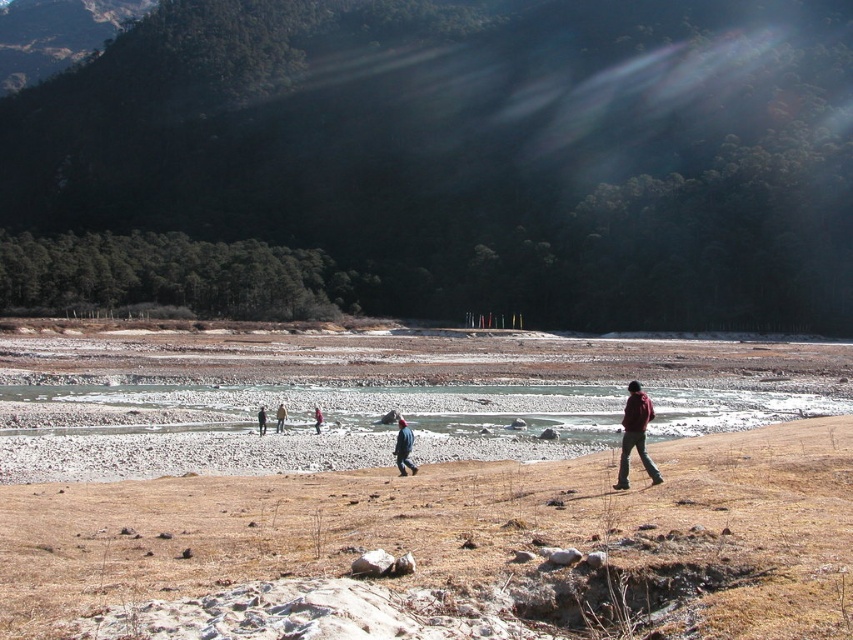
You are standing at the edge of the river and notice the brown dry grass at lower center and the dark blue jacket at center. Which object is closer to the ground?

The dark blue jacket at center is closer to the ground because the brown dry grass at lower center is above it.

You are standing at the edge of the riverbed and want to cross to the other side. You see the brown dry grass at lower center and the dark blue jacket at center. Which object is wider, and could that help you decide where to step?

The brown dry grass at lower center is wider than the dark blue jacket at center. Since the grass is wider, it might provide a stable path to step on compared to the narrower area near the jacket.

You are standing at the edge of the riverbed and want to walk to the dark red jacket at right. Which direction should you move relative to the brown dry grass at lower center?

You should move away from the brown dry grass at lower center towards the dark red jacket at right since the jacket is farther from the viewer compared to the grass.